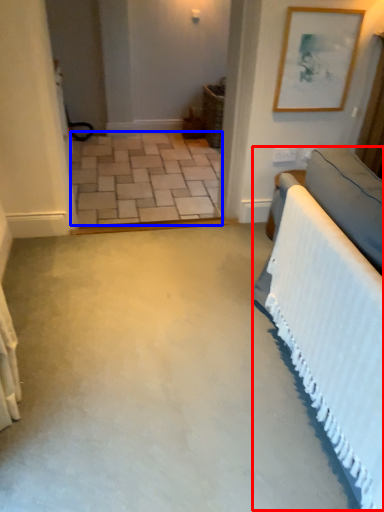
Question: Which object appears farthest to the camera in this image, bed (highlighted by a red box) or concrete (highlighted by a blue box)?

Choices:
 (A) bed
 (B) concrete

Answer: (B)